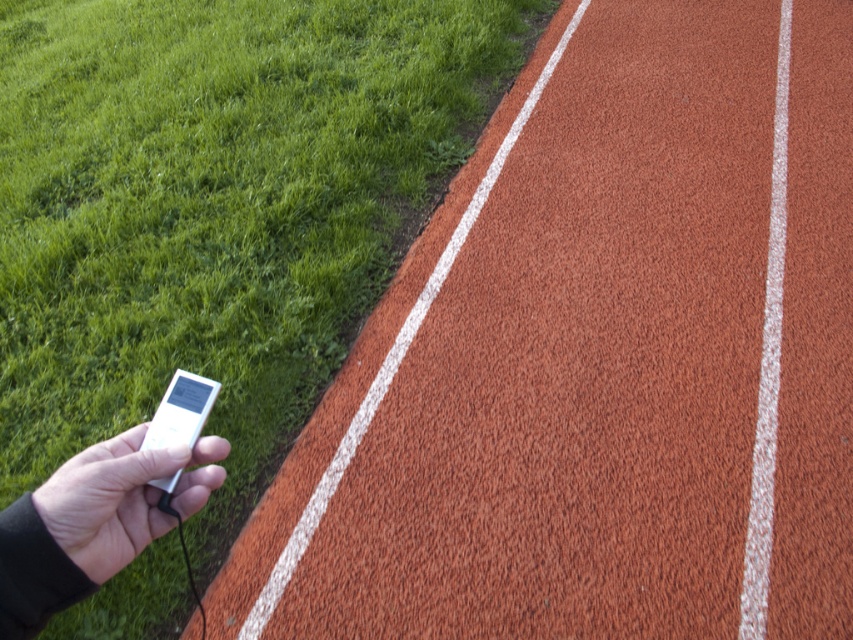
You are a runner preparing for a race and see the white matte ipod at lower left on the track. Is it safe to step on that spot?

The white matte ipod at lower left is located at point (122, 497) on the track. Since the track is a running area, stepping on that spot might risk damaging the device or causing a slip, so it is not safe.